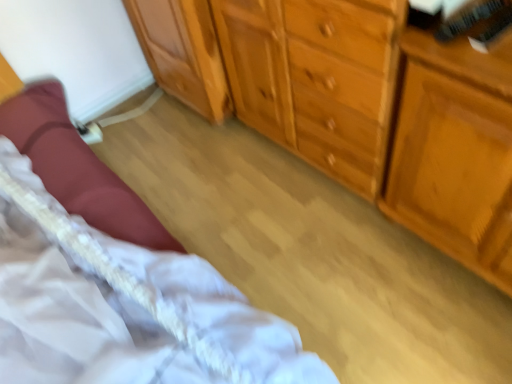
Where is `wooden cabinet at center, positioned as the second cabinetry in right-to-left order`? The width and height of the screenshot is (512, 384). wooden cabinet at center, positioned as the second cabinetry in right-to-left order is located at coordinates (183, 53).

This screenshot has height=384, width=512. What do you see at coordinates (183, 53) in the screenshot?
I see `wooden cabinet at center, positioned as the second cabinetry in right-to-left order` at bounding box center [183, 53].

The image size is (512, 384). Describe the element at coordinates (316, 78) in the screenshot. I see `light brown wood dresser at center, placed as the first cabinetry when sorted from right to left` at that location.

At what (x,y) coordinates should I click in order to perform the action: click on white lace bed at lower left. Please return your answer as a coordinate pair (x, y). Looking at the image, I should click on (76, 319).

Find the location of a particular element. This screenshot has height=384, width=512. wooden dresser at right is located at coordinates (455, 152).

Starting from the wooden chest of drawers at center, which cabinetry is the 1st one to the right? Please provide its 2D coordinates.

[(183, 53)]

Based on the photo, can you see wooden chest of drawers at center touching wooden cabinet at center, positioned as the second cabinetry in right-to-left order?

No, wooden chest of drawers at center is not making contact with wooden cabinet at center, positioned as the second cabinetry in right-to-left order.

In terms of width, does wooden chest of drawers at center look wider or thinner when compared to wooden cabinet at center, positioned as the second cabinetry in right-to-left order?

Considering their sizes, wooden chest of drawers at center looks broader than wooden cabinet at center, positioned as the second cabinetry in right-to-left order.

From a real-world perspective, which object stands above the other?

In real-world perspective, wooden chest of drawers at center is above.

Is light brown wood dresser at center, placed as the first cabinetry when sorted from right to left, positioned in front of wooden dresser at right?

No, light brown wood dresser at center, placed as the first cabinetry when sorted from right to left, is further to the viewer.

Can you confirm if light brown wood dresser at center, which is the second cabinetry from left to right, is bigger than wooden dresser at right?

Yes, light brown wood dresser at center, which is the second cabinetry from left to right, is bigger than wooden dresser at right.

Consider the image. Is light brown wood dresser at center, placed as the first cabinetry when sorted from right to left, looking in the opposite direction of wooden dresser at right?

light brown wood dresser at center, placed as the first cabinetry when sorted from right to left, is not turned away from wooden dresser at right.

Measure the distance between wooden dresser at right and wooden chest of drawers at center.

wooden dresser at right is 7.11 inches away from wooden chest of drawers at center.

Could you tell me if wooden dresser at right is facing wooden chest of drawers at center?

Yes, wooden dresser at right faces towards wooden chest of drawers at center.

Which of these two, wooden dresser at right or wooden chest of drawers at center, stands taller?

wooden chest of drawers at center is taller.

Is wooden dresser at right located outside wooden chest of drawers at center?

Yes, wooden dresser at right is located beyond the bounds of wooden chest of drawers at center.

Based on the photo, from the image's perspective, which one is positioned lower, white lace bed at lower left or wooden dresser at right?

white lace bed at lower left is shown below in the image.

Locate an element on the screen. vanity that appears above the white lace bed at lower left (from a real-world perspective) is located at coordinates (455, 152).

From the picture: Considering the relative sizes of wooden dresser at right and white lace bed at lower left in the image provided, is wooden dresser at right taller than white lace bed at lower left?

Correct, wooden dresser at right is much taller as white lace bed at lower left.

Is wooden dresser at right at the right side of white lace bed at lower left?

Yes, wooden dresser at right is to the right of white lace bed at lower left.

From a real-world perspective, is wooden dresser at right positioned above or below white lace bed at lower left?

wooden dresser at right is above white lace bed at lower left.

Is wooden dresser at right far from white lace bed at lower left?

No.

Does wooden cabinet at center, positioned as the second cabinetry in right-to-left order, have a greater width compared to light brown wood dresser at center, which is the second cabinetry from left to right?

Incorrect, the width of wooden cabinet at center, positioned as the second cabinetry in right-to-left order, does not surpass that of light brown wood dresser at center, which is the second cabinetry from left to right.

Can you confirm if wooden cabinet at center, positioned as the second cabinetry in right-to-left order, is positioned to the right of light brown wood dresser at center, which is the second cabinetry from left to right?

No, wooden cabinet at center, positioned as the second cabinetry in right-to-left order, is not to the right of light brown wood dresser at center, which is the second cabinetry from left to right.

Does wooden cabinet at center, the 1th cabinetry in the left-to-right sequence, come behind light brown wood dresser at center, placed as the first cabinetry when sorted from right to left?

Yes.

Is wooden cabinet at center, the 1th cabinetry in the left-to-right sequence, beside wooden dresser at right?

No, wooden cabinet at center, the 1th cabinetry in the left-to-right sequence, is not beside wooden dresser at right.

From a real-world perspective, relative to wooden dresser at right, is wooden cabinet at center, the 1th cabinetry in the left-to-right sequence, vertically above or below?

Clearly, from a real-world perspective, wooden cabinet at center, the 1th cabinetry in the left-to-right sequence, is below wooden dresser at right.

Which of these two, wooden cabinet at center, positioned as the second cabinetry in right-to-left order, or wooden dresser at right, stands shorter?

Standing shorter between the two is wooden cabinet at center, positioned as the second cabinetry in right-to-left order.

Who is bigger, wooden cabinet at center, positioned as the second cabinetry in right-to-left order, or wooden dresser at right?

Bigger between the two is wooden dresser at right.

Locate an element on the screen. This screenshot has height=384, width=512. the 2nd cabinetry above when counting from the wooden chest of drawers at center (from the image's perspective) is located at coordinates (183, 53).

You are a GUI agent. You are given a task and a screenshot of the screen. Output one action in this format:
    pyautogui.click(x=<x>, y=<y>)
    Task: Click on the vanity in front of the light brown wood dresser at center, placed as the first cabinetry when sorted from right to left
    The image size is (512, 384).
    Given the screenshot: What is the action you would take?
    pyautogui.click(x=455, y=152)

Looking at the image, which one is located closer to wooden cabinet at center, the 1th cabinetry in the left-to-right sequence, wooden dresser at right or white lace bed at lower left?

The object closer to wooden cabinet at center, the 1th cabinetry in the left-to-right sequence, is white lace bed at lower left.

Based on their spatial positions, is wooden cabinet at center, the 1th cabinetry in the left-to-right sequence, or wooden chest of drawers at center further from white lace bed at lower left?

wooden cabinet at center, the 1th cabinetry in the left-to-right sequence.

Based on their spatial positions, is light brown wood dresser at center, placed as the first cabinetry when sorted from right to left, or wooden cabinet at center, the 1th cabinetry in the left-to-right sequence, closer to wooden dresser at right?

light brown wood dresser at center, placed as the first cabinetry when sorted from right to left.

Looking at the image, which one is located closer to light brown wood dresser at center, which is the second cabinetry from left to right, wooden chest of drawers at center or wooden dresser at right?

The object closer to light brown wood dresser at center, which is the second cabinetry from left to right, is wooden chest of drawers at center.

Looking at the image, which one is located closer to wooden cabinet at center, positioned as the second cabinetry in right-to-left order, light brown wood dresser at center, placed as the first cabinetry when sorted from right to left, or wooden dresser at right?

light brown wood dresser at center, placed as the first cabinetry when sorted from right to left, is positioned closer to the anchor wooden cabinet at center, positioned as the second cabinetry in right-to-left order.

From the image, which object appears to be farther from wooden dresser at right, white lace bed at lower left or wooden chest of drawers at center?

white lace bed at lower left is further to wooden dresser at right.

Looking at the image, which one is located further to wooden cabinet at center, the 1th cabinetry in the left-to-right sequence, wooden chest of drawers at center or light brown wood dresser at center, placed as the first cabinetry when sorted from right to left?

light brown wood dresser at center, placed as the first cabinetry when sorted from right to left, is further to wooden cabinet at center, the 1th cabinetry in the left-to-right sequence.

Estimate the real-world distances between objects in this image. Which object is further from light brown wood dresser at center, which is the second cabinetry from left to right, white lace bed at lower left or wooden dresser at right?

The object further to light brown wood dresser at center, which is the second cabinetry from left to right, is white lace bed at lower left.

Where is `cabinetry located between wooden cabinet at center, positioned as the second cabinetry in right-to-left order, and wooden dresser at right in the left-right direction`? The height and width of the screenshot is (384, 512). cabinetry located between wooden cabinet at center, positioned as the second cabinetry in right-to-left order, and wooden dresser at right in the left-right direction is located at coordinates (316, 78).

This screenshot has width=512, height=384. In order to click on cabinetry between wooden cabinet at center, positioned as the second cabinetry in right-to-left order, and white lace bed at lower left, in the vertical direction in this screenshot , I will do `click(316, 78)`.

At what (x,y) coordinates should I click in order to perform the action: click on chest of drawers between white lace bed at lower left and wooden dresser at right. Please return your answer as a coordinate pair (x, y). Image resolution: width=512 pixels, height=384 pixels. Looking at the image, I should click on (305, 94).

Image resolution: width=512 pixels, height=384 pixels. Identify the location of cabinetry between wooden chest of drawers at center and wooden cabinet at center, the 1th cabinetry in the left-to-right sequence, from front to back. [x=316, y=78].